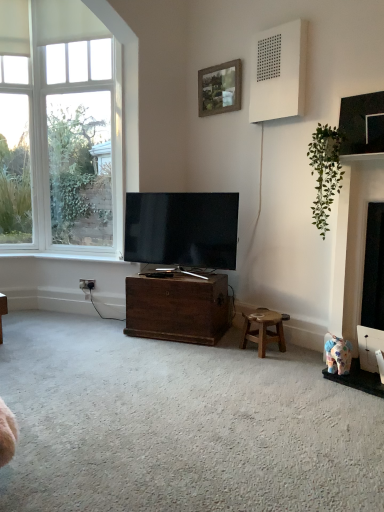
Identify the location of vacant region above white painted wood at lower left (from a real-world perspective). (74, 256).